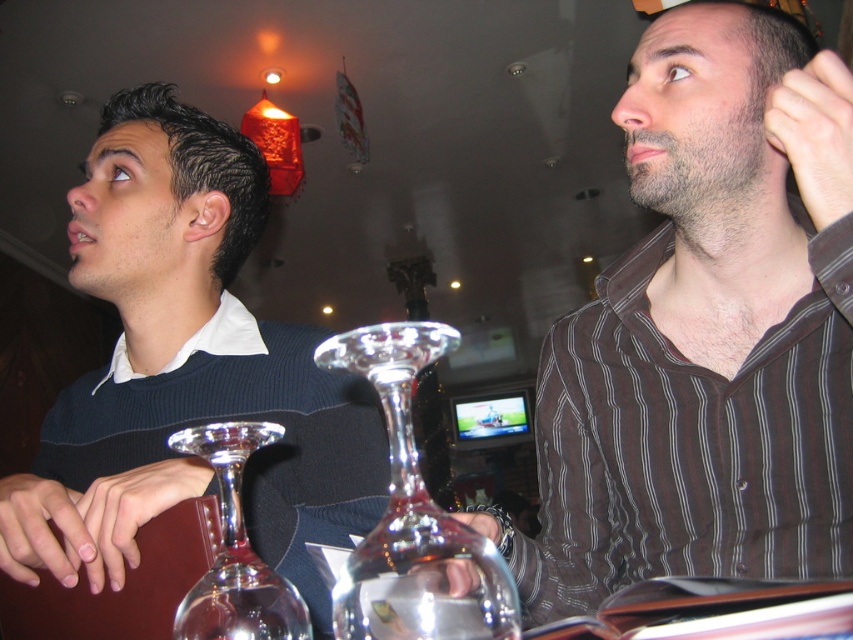
You are a waiter at a restaurant and need to place a 10 cm wide bottle on the table between the clear glass wine glass at center and the transparent glass wine glass at center. Can you fit the bottle between them?

The clear glass wine glass at center is wider than the transparent glass wine glass at center. The combined width of both glasses is not specified, so it is uncertain if there is enough space for the 10 cm wide bottle between them.

You are standing at the restaurant table and want to place a napkin on the exact location of the point labeled as point [706,332]. Which object should you place the napkin near?

The point [706,332] indicates the brown striped shirt at upper right, so you should place the napkin near the brown striped shirt at upper right.

You are a bartender who needs to choose between the clear glass wine glass at center and the transparent glass wine glass at center to serve a drink that requires a tall glass. Which one should you pick?

The clear glass wine glass at center is much taller than the transparent glass wine glass at center, so you should choose the clear glass wine glass at center to serve the drink.